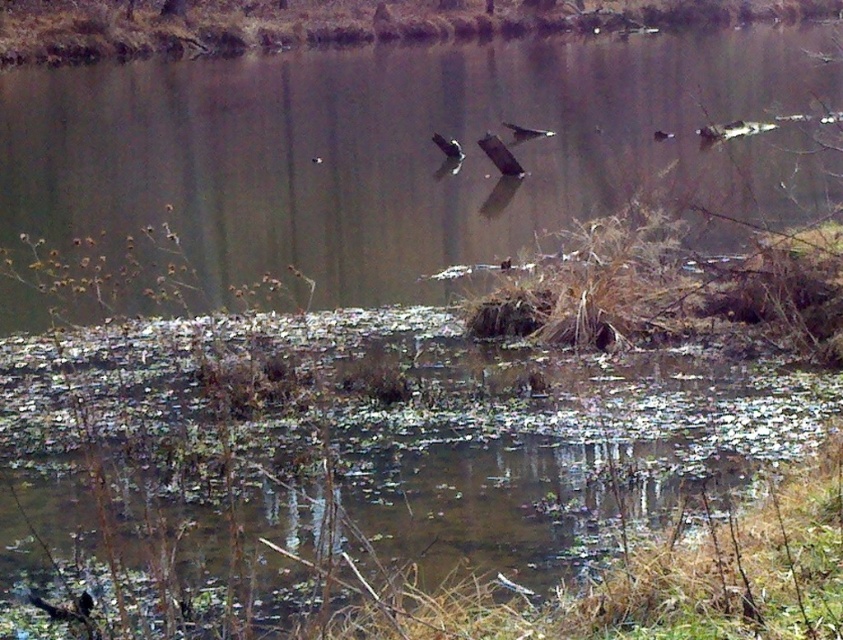
You are a birdwatcher observing the scene. You notice two objects in the image. One is dark brown feathers at lower left and the other is dark brown feathered bird at center. Which object is smaller in size?

The dark brown feathers at lower left is thinner than the dark brown feathered bird at center, so the dark brown feathers at lower left is smaller in size.